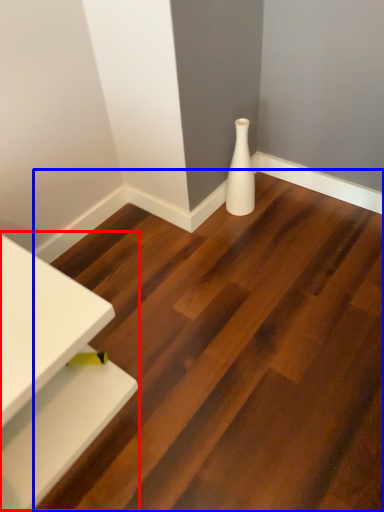
Question: Which point is further to the camera, table (highlighted by a red box) or stair (highlighted by a blue box)?

Choices:
 (A) table
 (B) stair

Answer: (A)